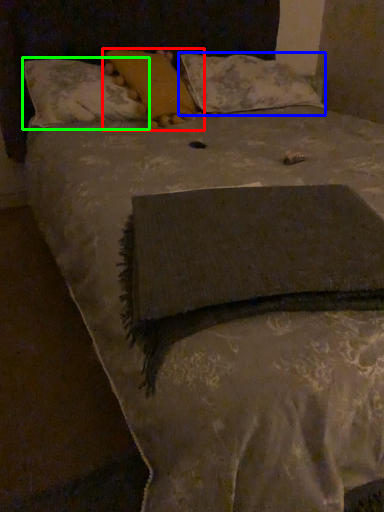
Question: Considering the real-world distances, which object is closest to pillow (highlighted by a red box)? pillow (highlighted by a blue box) or pillow (highlighted by a green box).

Choices:
 (A) pillow
 (B) pillow

Answer: (B)